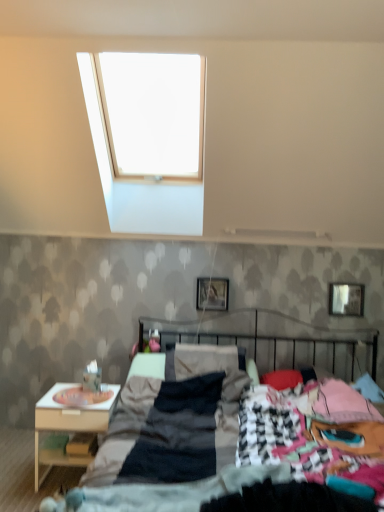
This screenshot has width=384, height=512. I want to click on blank space situated above white wood nightstand at lower left (from a real-world perspective), so click(x=89, y=392).